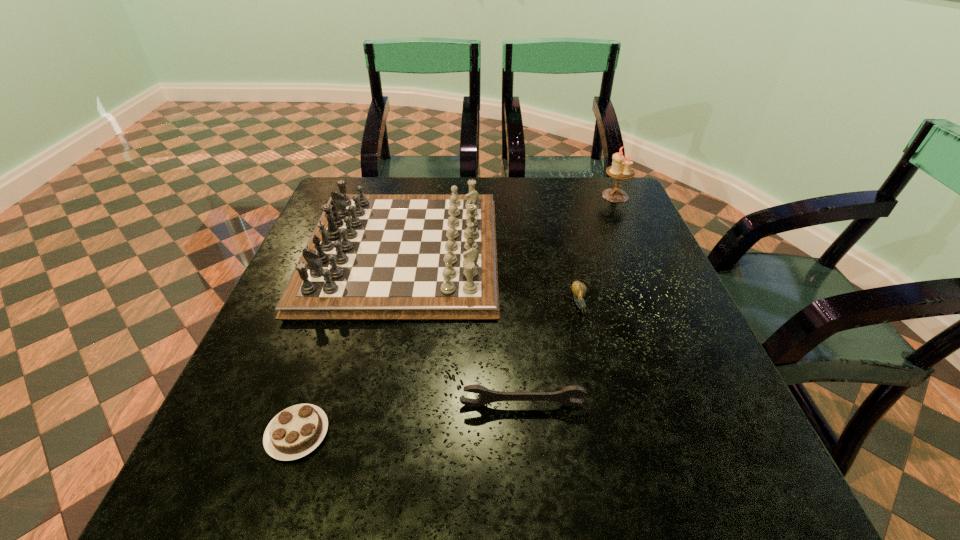
Identify the location of the tallest object. tap(621, 169).

This screenshot has width=960, height=540. I want to click on candle holder, so click(621, 169).

Where is `chessboard`? The height and width of the screenshot is (540, 960). chessboard is located at coordinates (371, 256).

Where is `wrench`? wrench is located at coordinates (563, 396).

At what (x,y) coordinates should I click in order to perform the action: click on the second shortest object. Please return your answer as a coordinate pair (x, y). This screenshot has width=960, height=540. Looking at the image, I should click on (579, 289).

Find the location of a particular element. The width and height of the screenshot is (960, 540). the second object from right to left is located at coordinates (579, 289).

This screenshot has width=960, height=540. I want to click on the shortest object, so click(296, 431).

Locate an element on the screen. The height and width of the screenshot is (540, 960). vacant space situated 0.130m on the left of the tallest object is located at coordinates (558, 195).

The width and height of the screenshot is (960, 540). Find the location of `free space located from the player's perspective of the second tallest object`. free space located from the player's perspective of the second tallest object is located at coordinates (548, 251).

At what (x,y) coordinates should I click in order to perform the action: click on vacant point located on the open ends of the wrench. Please return your answer as a coordinate pair (x, y). The width and height of the screenshot is (960, 540). Looking at the image, I should click on (529, 495).